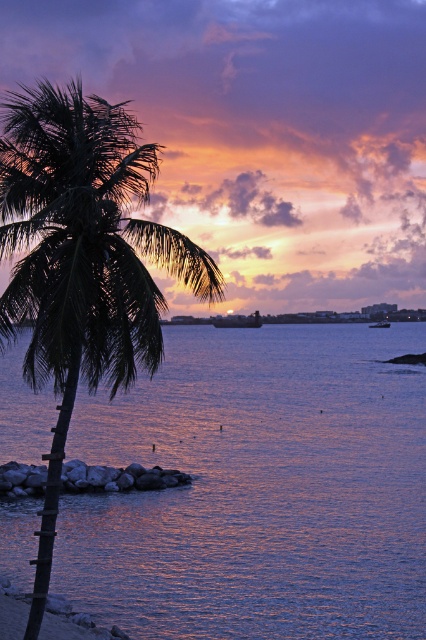
Is point (192, 284) behind point (388, 323)?

No.

Is point (48, 477) closer to camera compared to point (385, 326)?

Yes, it is.

The height and width of the screenshot is (640, 426). Describe the element at coordinates (81, 260) in the screenshot. I see `green leafy palm tree at left` at that location.

This screenshot has width=426, height=640. Identify the location of green leafy palm tree at left. (81, 260).

Is point (371, 476) closer to viewer compared to point (230, 321)?

Yes, it is.

Can you confirm if purple reflective water at center is positioned below wooden boat at center?

Yes, purple reflective water at center is below wooden boat at center.

Does point (268, 348) come closer to viewer compared to point (233, 324)?

Yes, point (268, 348) is closer to viewer.

At what (x,y) coordinates should I click in order to perform the action: click on purple reflective water at center. Please return your answer as a coordinate pair (x, y). Image resolution: width=426 pixels, height=640 pixels. Looking at the image, I should click on (256, 490).

Between point (115, 524) and point (388, 324), which one is positioned in front?

Point (115, 524)

Measure the distance from purple reflective water at center to metallic gray boat at center.

A distance of 56.68 meters exists between purple reflective water at center and metallic gray boat at center.

Is point (379, 513) farther from viewer compared to point (374, 324)?

No, it is in front of (374, 324).

I want to click on purple reflective water at center, so click(256, 490).